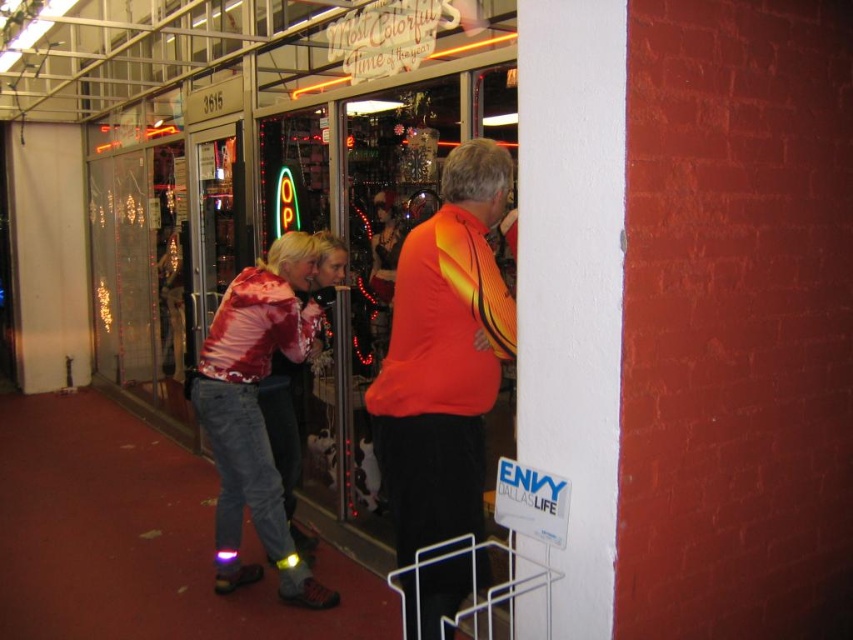
Consider the image. Who is shorter, orange jersey at center or shiny red jacket at center?

orange jersey at center is shorter.

What do you see at coordinates (444, 356) in the screenshot? I see `orange jersey at center` at bounding box center [444, 356].

Between point (451, 285) and point (292, 275), which one is positioned in front?

Positioned in front is point (451, 285).

Find the location of a particular element. This screenshot has height=640, width=853. orange jersey at center is located at coordinates (444, 356).